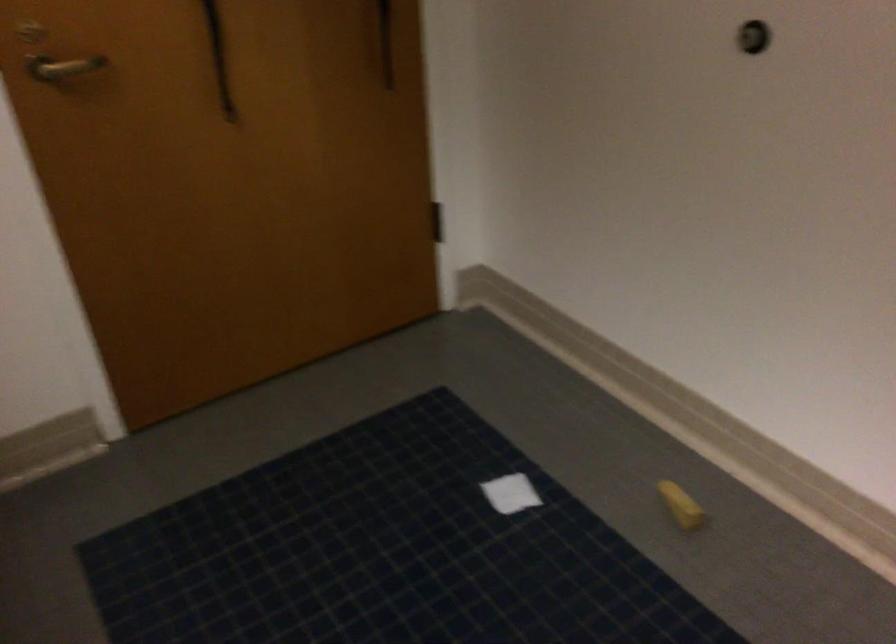
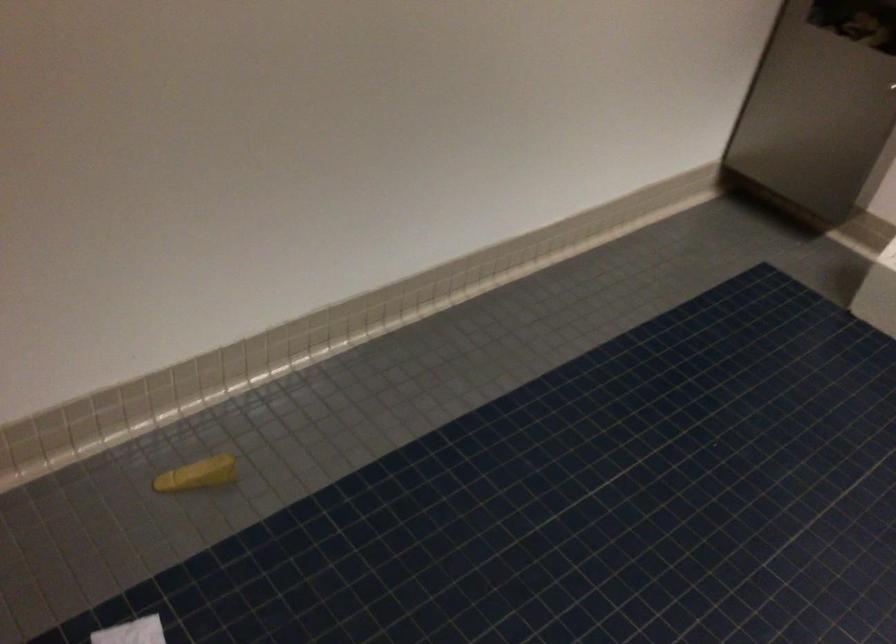
The point at (685, 505) is marked in the first image. Where is the corresponding point in the second image?

(197, 474)